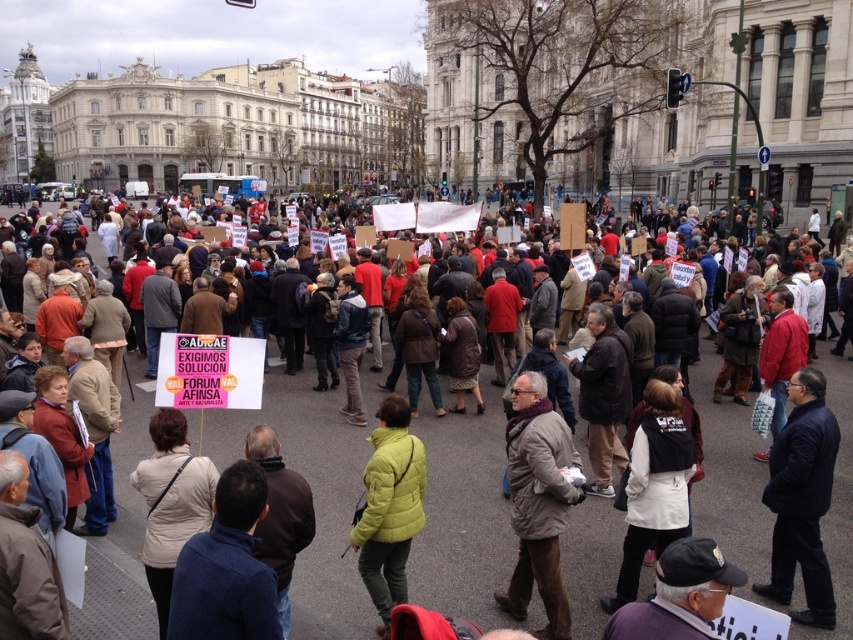
Between multicolored fabric crowd at center and matte yellow jacket at center, which one is positioned higher?

multicolored fabric crowd at center is above.

Can you confirm if multicolored fabric crowd at center is positioned to the left of matte yellow jacket at center?

In fact, multicolored fabric crowd at center is to the right of matte yellow jacket at center.

Between point (225, 433) and point (399, 580), which one is positioned behind?

The point (225, 433) is more distant.

Where is `multicolored fabric crowd at center`? multicolored fabric crowd at center is located at coordinates (312, 488).